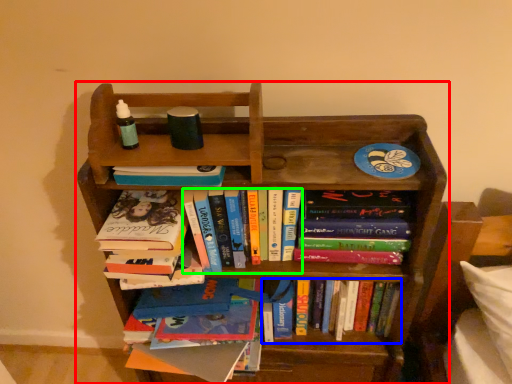
Question: Considering the real-world distances, which object is farthest from bookcase (highlighted by a red box)? book (highlighted by a blue box) or book (highlighted by a green box)?

Choices:
 (A) book
 (B) book

Answer: (A)